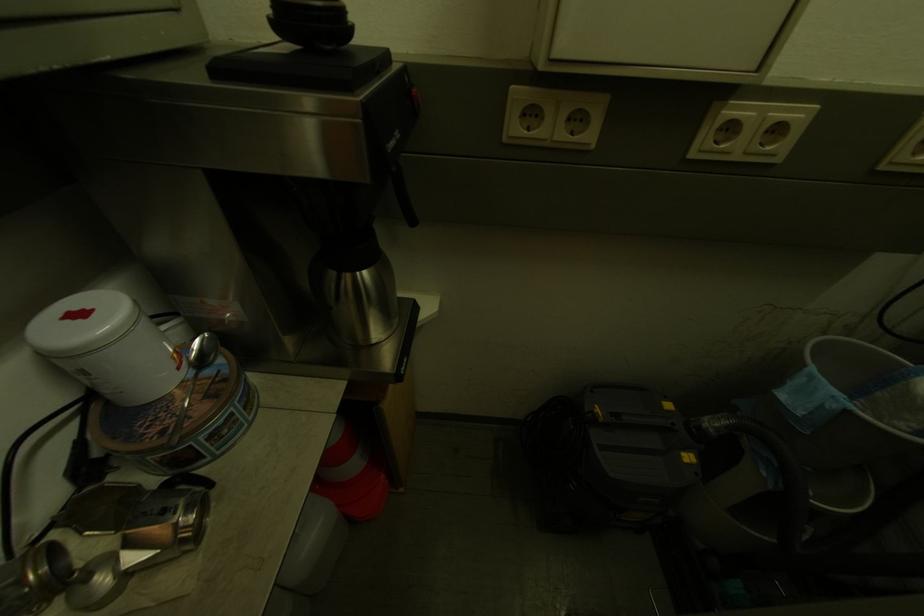
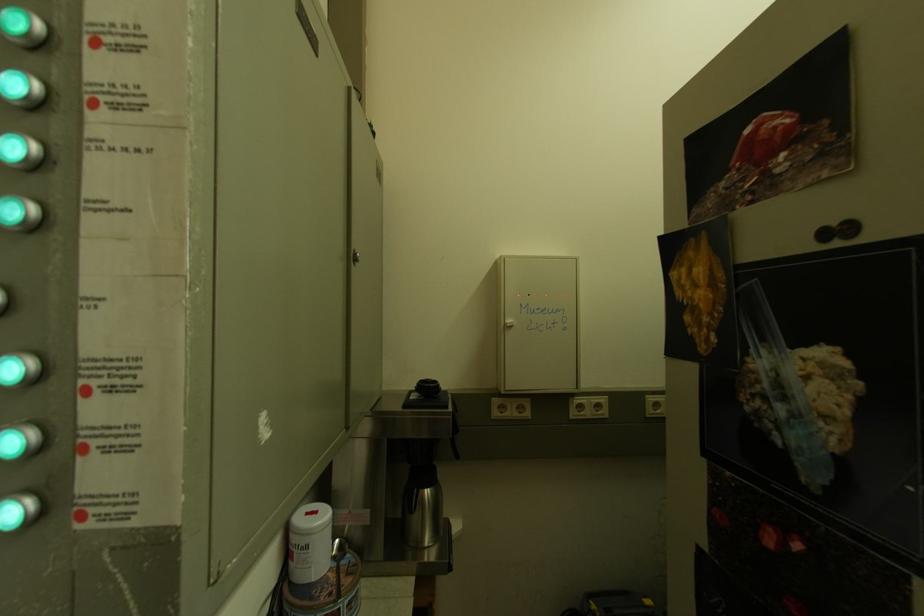
Locate, in the second image, the point that corresponds to point 180,410 in the first image.

(339, 586)